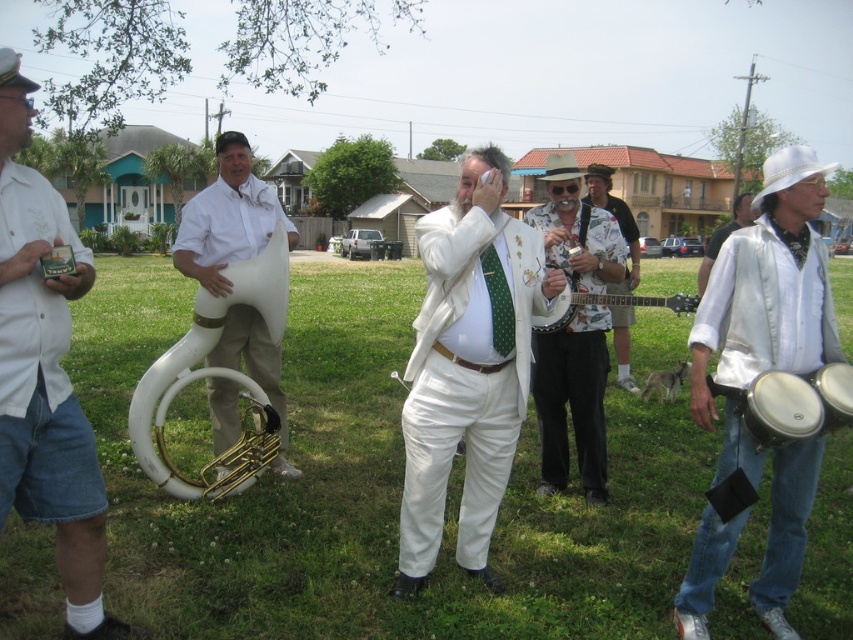
Can you confirm if green grass at center is bigger than white matte tuba at left?

Yes.

Who is higher up, green grass at center or white matte tuba at left?

white matte tuba at left is above.

Does point (833, 284) come in front of point (270, 234)?

No, it is behind (270, 234).

Locate an element on the screen. green grass at center is located at coordinates (372, 486).

This screenshot has width=853, height=640. I want to click on green grass at center, so click(x=372, y=486).

Is green grass at center thinner than white matte suit at center?

No, green grass at center is not thinner than white matte suit at center.

This screenshot has width=853, height=640. I want to click on green grass at center, so click(x=372, y=486).

Locate an element on the screen. This screenshot has width=853, height=640. green grass at center is located at coordinates (372, 486).

Measure the distance between point (90, 253) and camera.

Point (90, 253) is 3.20 meters away from camera.

Is white cotton shorts at left positioned before printed fabric guitar at center?

Yes, it is.

Who is more forward, (12, 291) or (636, 252)?

Point (12, 291) is more forward.

Where is `white cotton shorts at left`? white cotton shorts at left is located at coordinates (45, 371).